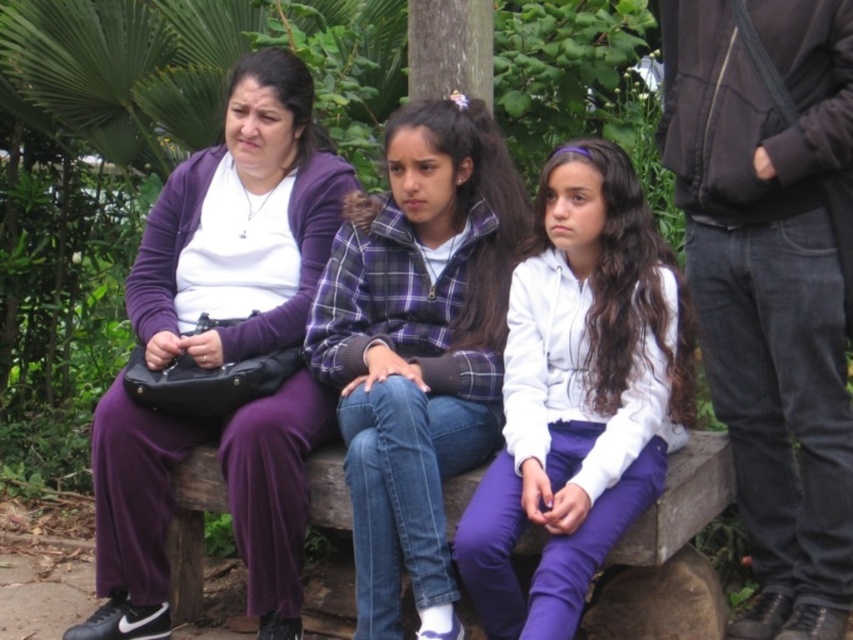
Question: Which of these objects is positioned closest to the purple matte pants at left?

Choices:
 (A) plaid fabric jacket at center
 (B) white matte jacket at center

Answer: (A)

Question: Where is purple matte pants at left located in relation to plaid fabric jacket at center in the image?

Choices:
 (A) above
 (B) below

Answer: (A)

Question: Which of these objects is positioned farthest from the white matte jacket at center?

Choices:
 (A) plaid fabric jacket at center
 (B) purple matte pants at left

Answer: (B)

Question: Which point is farther to the camera?

Choices:
 (A) (352, 388)
 (B) (119, 392)
 (C) (672, 308)

Answer: (B)

Question: Can you confirm if purple matte pants at left is wider than plaid fabric jacket at center?

Choices:
 (A) no
 (B) yes

Answer: (B)

Question: Is plaid fabric jacket at center further to the viewer compared to white matte jacket at center?

Choices:
 (A) no
 (B) yes

Answer: (B)